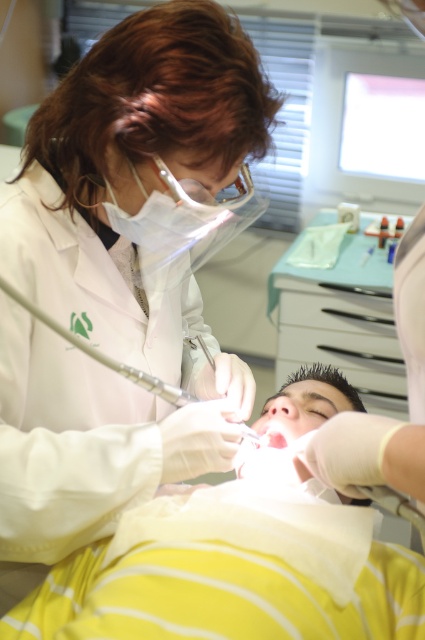
Who is taller, metallic/transparent dental drill at center or pink glossy lips at center?

With more height is metallic/transparent dental drill at center.

Is metallic/transparent dental drill at center above pink glossy lips at center?

Indeed, metallic/transparent dental drill at center is positioned over pink glossy lips at center.

Is point (119, 364) closer to camera compared to point (272, 440)?

Yes, it is in front of point (272, 440).

The image size is (425, 640). Identify the location of metallic/transparent dental drill at center. (104, 353).

What do you see at coordinates (231, 576) in the screenshot? I see `yellow striped fabric at lower center` at bounding box center [231, 576].

From the picture: Who is shorter, yellow striped fabric at lower center or pink glossy lips at center?

pink glossy lips at center

Between point (323, 508) and point (272, 445), which one is positioned in front?

Point (323, 508)

Identify the location of yellow striped fabric at lower center. This screenshot has height=640, width=425. (231, 576).

Between yellow striped fabric at lower center and metallic/transparent dental drill at center, which one is positioned lower?

Positioned lower is yellow striped fabric at lower center.

Is yellow striped fabric at lower center below metallic/transparent dental drill at center?

Yes, yellow striped fabric at lower center is below metallic/transparent dental drill at center.

Find the location of a particular element. This screenshot has height=640, width=425. yellow striped fabric at lower center is located at coordinates (231, 576).